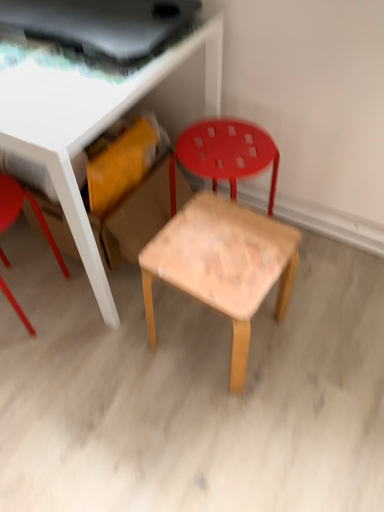
At what (x,y) coordinates should I click in order to perform the action: click on free location to the right of natural wood stool at center. Please return your answer as a coordinate pair (x, y). The image size is (384, 512). Looking at the image, I should click on (311, 344).